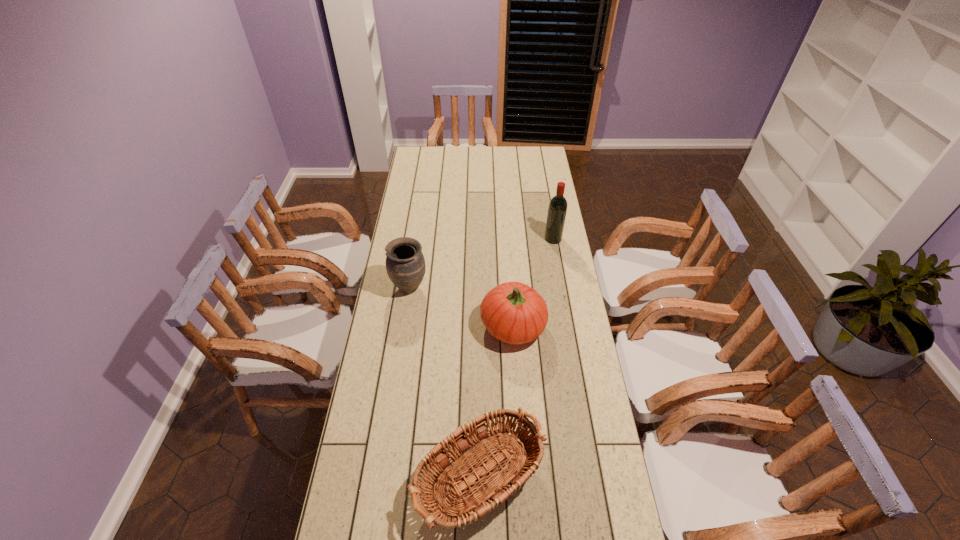
The image size is (960, 540). Identify the location of wine bottle that is at the right edge. (557, 209).

What are the coordinates of `pumpkin at the right edge` in the screenshot? It's located at (513, 312).

Find the location of a particular element. free location at the far edge of the desktop is located at coordinates (464, 159).

In the image, there is a desktop. Find the location of `free space at the left edge`. free space at the left edge is located at coordinates pyautogui.click(x=424, y=172).

In order to click on free space at the right edge of the desktop in this screenshot , I will do `click(561, 255)`.

This screenshot has height=540, width=960. In the image, there is a desktop. Identify the location of free space at the far right corner. (522, 148).

At what (x,y) coordinates should I click in order to perform the action: click on free area in between the pumpkin and the urn. Please return your answer as a coordinate pair (x, y). This screenshot has width=960, height=540. Looking at the image, I should click on [x=461, y=307].

Identify the location of blank region between the pumpkin and the leftmost object. (461, 307).

Where is `free spot between the pumpkin and the tallest object`? This screenshot has height=540, width=960. free spot between the pumpkin and the tallest object is located at coordinates (533, 282).

You are a GUI agent. You are given a task and a screenshot of the screen. Output one action in this format:
    pyautogui.click(x=<x>, y=<y>)
    Task: Click on the free space between the rightmost object and the pumpkin
    The width and height of the screenshot is (960, 540).
    Given the screenshot: What is the action you would take?
    pyautogui.click(x=533, y=282)